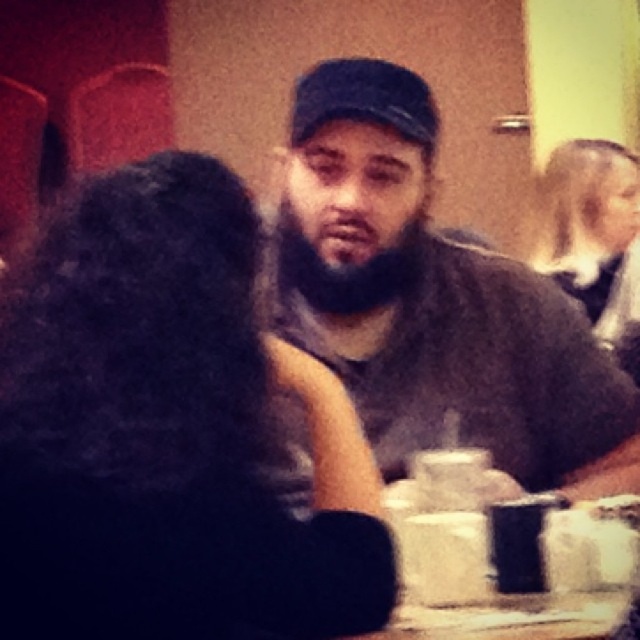
Describe the element at coordinates (433, 300) in the screenshot. I see `dark gray t-shirt at center` at that location.

Can you confirm if dark gray t-shirt at center is smaller than black fabric baseball cap at center?

Incorrect, dark gray t-shirt at center is not smaller in size than black fabric baseball cap at center.

The width and height of the screenshot is (640, 640). What are the coordinates of `dark gray t-shirt at center` in the screenshot? It's located at (433, 300).